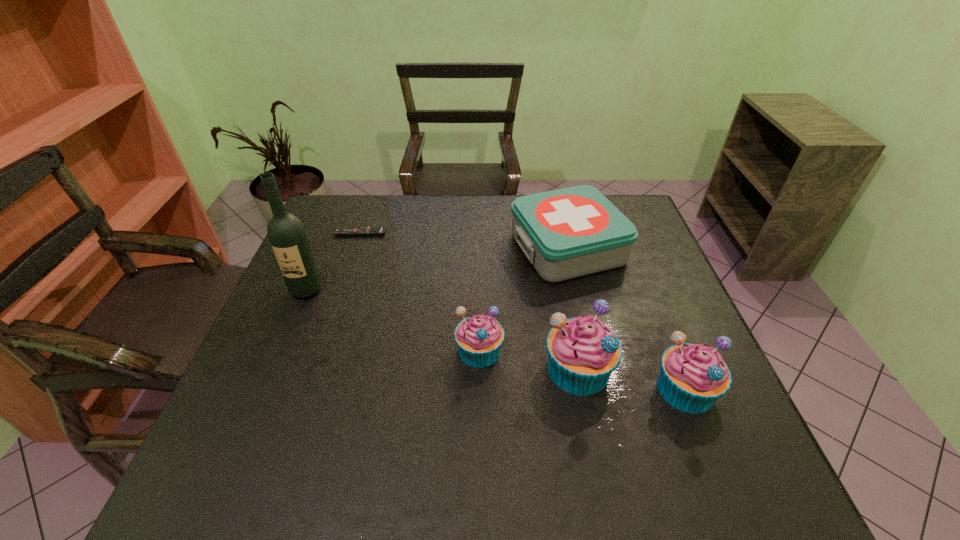
In the image, there is a desktop. Identify the location of vacant space at the near right corner. This screenshot has width=960, height=540. (679, 437).

Where is `free space between the third tallest object and the first-aid kit`? The width and height of the screenshot is (960, 540). free space between the third tallest object and the first-aid kit is located at coordinates (626, 319).

At what (x,y) coordinates should I click in order to perform the action: click on free space that is in between the fourth shortest object and the second muffin from right to left. Please return your answer as a coordinate pair (x, y). The width and height of the screenshot is (960, 540). Looking at the image, I should click on [632, 379].

Find the location of a particular element. This screenshot has height=540, width=960. empty location between the first-aid kit and the wine bottle is located at coordinates (437, 269).

The width and height of the screenshot is (960, 540). Find the location of `free space between the second muffin from left to right and the wine bottle`. free space between the second muffin from left to right and the wine bottle is located at coordinates point(443,329).

You are a GUI agent. You are given a task and a screenshot of the screen. Output one action in this format:
    pyautogui.click(x=<x>, y=<y>)
    Task: Click on the free space between the remote control and the leftmost muffin
    This screenshot has height=540, width=960.
    Given the screenshot: What is the action you would take?
    pyautogui.click(x=420, y=292)

What are the coordinates of `free spot between the tallest object and the leftmost muffin` in the screenshot? It's located at (393, 320).

At what (x,y) coordinates should I click in order to perform the action: click on vacant area that lies between the second muffin from right to left and the remote control. Please return your answer as a coordinate pair (x, y). Looking at the image, I should click on (469, 301).

The image size is (960, 540). What are the coordinates of `free spot between the first-aid kit and the shortest object` in the screenshot? It's located at (464, 240).

Identify the location of the fourth closest object to the first-aid kit. The width and height of the screenshot is (960, 540). (378, 230).